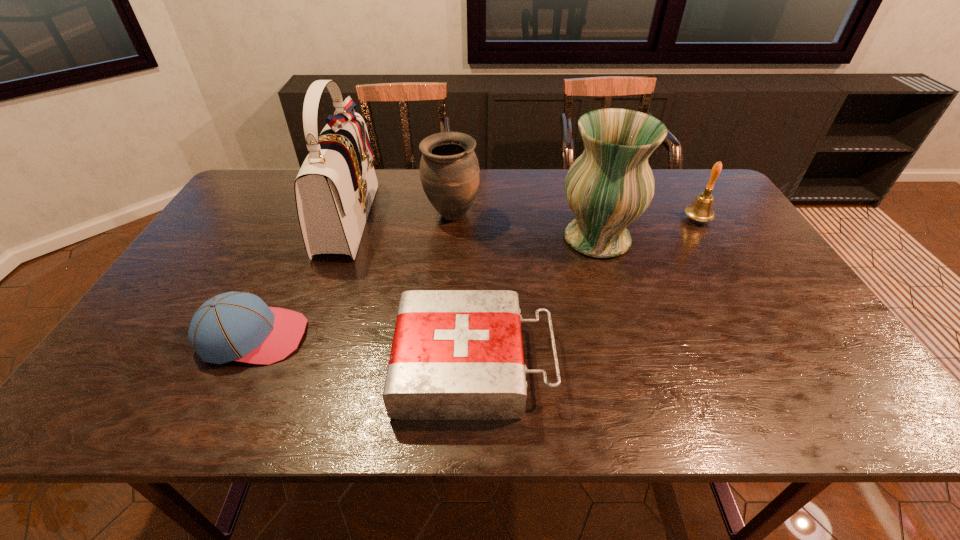
Where is `free location located on the left of the fourth shortest object`? The height and width of the screenshot is (540, 960). free location located on the left of the fourth shortest object is located at coordinates (300, 215).

Locate an element on the screen. This screenshot has height=540, width=960. vacant space located on the right of the bell is located at coordinates 740,219.

You are a GUI agent. You are given a task and a screenshot of the screen. Output one action in this format:
    pyautogui.click(x=<x>, y=<y>)
    Task: Click on the free region located 0.160m on the front-facing side of the fifth tallest object
    Image resolution: width=960 pixels, height=540 pixels.
    Given the screenshot: What is the action you would take?
    pyautogui.click(x=373, y=336)

At what (x,y) coordinates should I click in order to perform the action: click on vacant space situated on the front side of the first-aid kit. Please return your answer as a coordinate pair (x, y). The image size is (960, 540). Looking at the image, I should click on (723, 363).

This screenshot has width=960, height=540. Identify the location of satchel present at the far edge. (334, 190).

The height and width of the screenshot is (540, 960). What are the coordinates of `urn located in the far edge section of the desktop` in the screenshot? It's located at (449, 170).

Identify the location of object present at the near edge. Image resolution: width=960 pixels, height=540 pixels. (456, 354).

Where is `object located in the left edge section of the desktop`? This screenshot has width=960, height=540. object located in the left edge section of the desktop is located at coordinates (235, 326).

What are the coordinates of `object that is positioned at the right edge` in the screenshot? It's located at 701,210.

You are a GUI agent. You are given a task and a screenshot of the screen. Output one action in this format:
    pyautogui.click(x=<x>, y=<y>)
    Task: Click on the vacant space at the far edge of the desktop
    
    Given the screenshot: What is the action you would take?
    pyautogui.click(x=670, y=205)